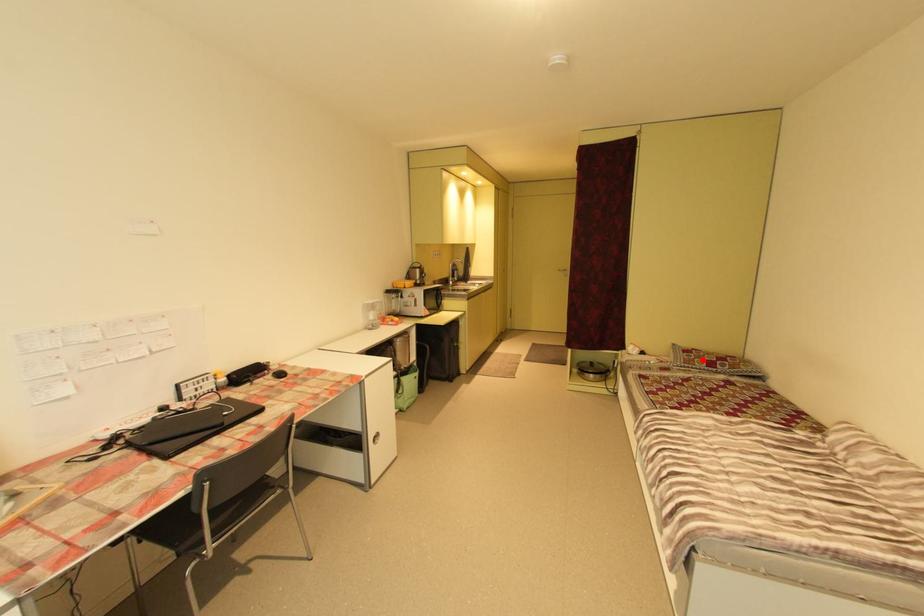
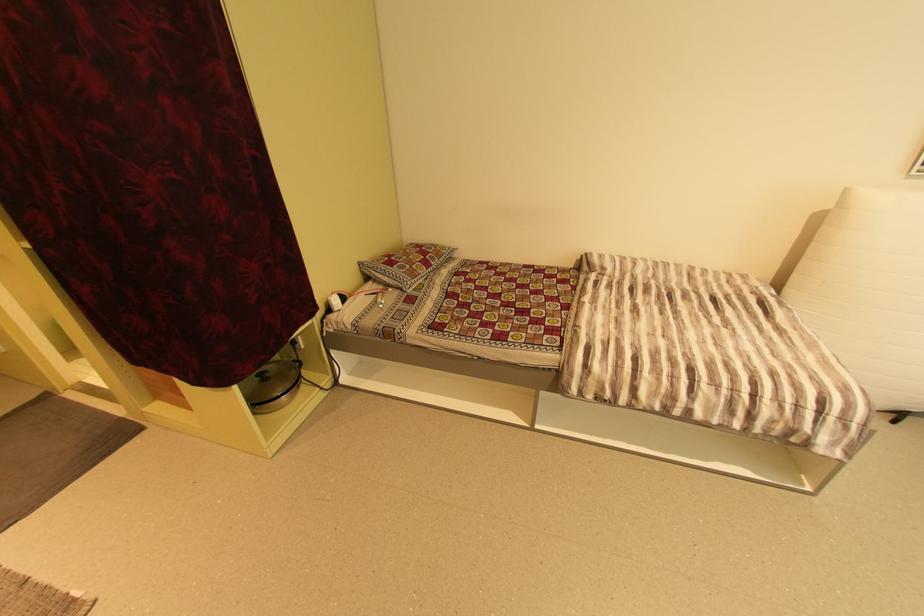
Locate, in the second image, the point that corresponds to the highlighted location in the first image.

(420, 267)